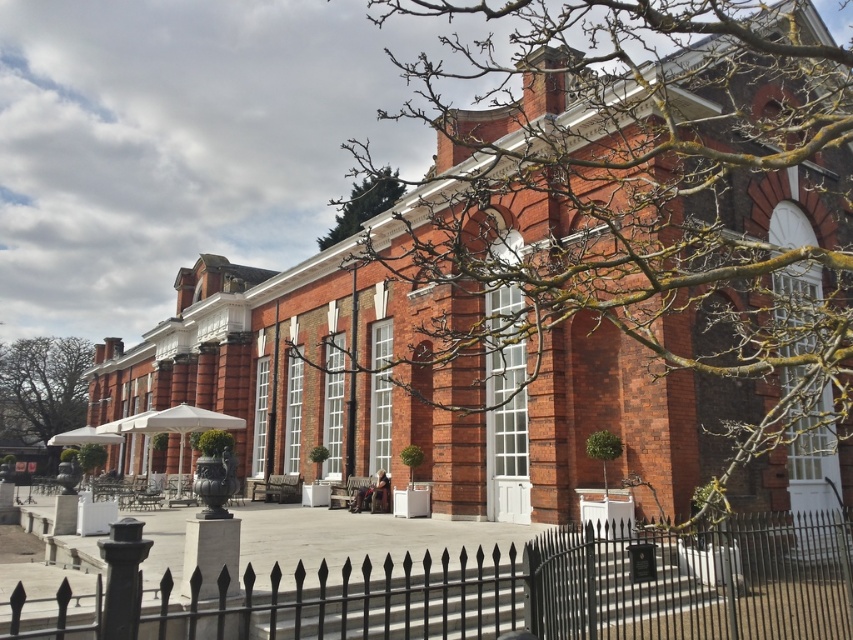
You are standing in front of the historic building and want to determine the spatial relationship between two points marked in the scene. Which point is closer to you, point (746, 538) or point (51, 369)?

Point (746, 538) is in front of point (51, 369), so it is closer to you.

You are standing in front of the grand historic building and notice a specific point marked at coordinates (483, 588). Based on the scene description, can you identify what object this point is located on?

The point at coordinates (483, 588) is located on the black wrought iron fence at lower center.